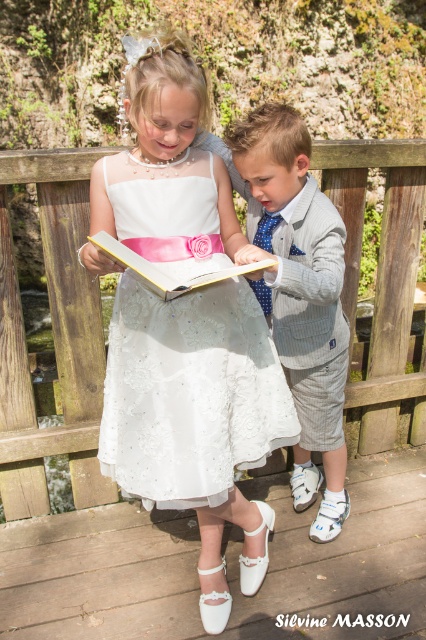
In the scene shown: Can you confirm if white lace dress at center is thinner than light gray pinstripe suit at center?

Incorrect, white lace dress at center's width is not less than light gray pinstripe suit at center's.

Between white lace dress at center and light gray pinstripe suit at center, which one appears on the left side from the viewer's perspective?

Positioned to the left is white lace dress at center.

What do you see at coordinates (189, 394) in the screenshot? This screenshot has height=640, width=426. I see `white lace dress at center` at bounding box center [189, 394].

You are a GUI agent. You are given a task and a screenshot of the screen. Output one action in this format:
    pyautogui.click(x=<x>, y=<y>)
    Task: Click on the white lace dress at center
    Image resolution: width=426 pixels, height=640 pixels.
    Given the screenshot: What is the action you would take?
    pyautogui.click(x=189, y=394)

Is light gray pinstripe suit at center taller than hardcover book at center?

Indeed, light gray pinstripe suit at center has a greater height compared to hardcover book at center.

Is light gray pinstripe suit at center to the left of hardcover book at center from the viewer's perspective?

In fact, light gray pinstripe suit at center is to the right of hardcover book at center.

Who is more distant from viewer, (247,212) or (115,244)?

Point (247,212)

Find the location of a particular element. light gray pinstripe suit at center is located at coordinates (299, 296).

Which is in front, point (160, 394) or point (253, 269)?

Positioned in front is point (253, 269).

What are the coordinates of `white lace dress at center` in the screenshot? It's located at 189,394.

You are a GUI agent. You are given a task and a screenshot of the screen. Output one action in this format:
    pyautogui.click(x=<x>, y=<y>)
    Task: Click on the white lace dress at center
    The height and width of the screenshot is (640, 426).
    Given the screenshot: What is the action you would take?
    pyautogui.click(x=189, y=394)